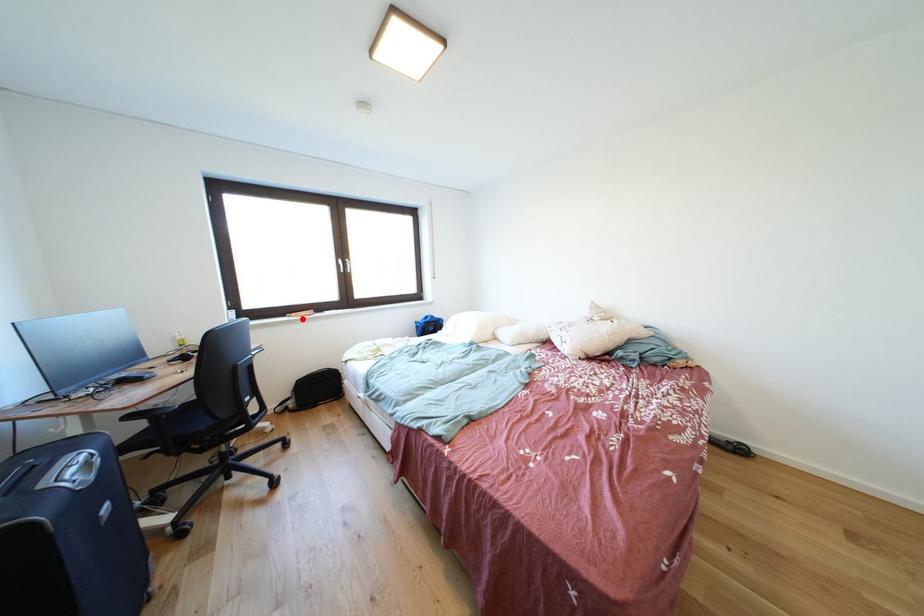
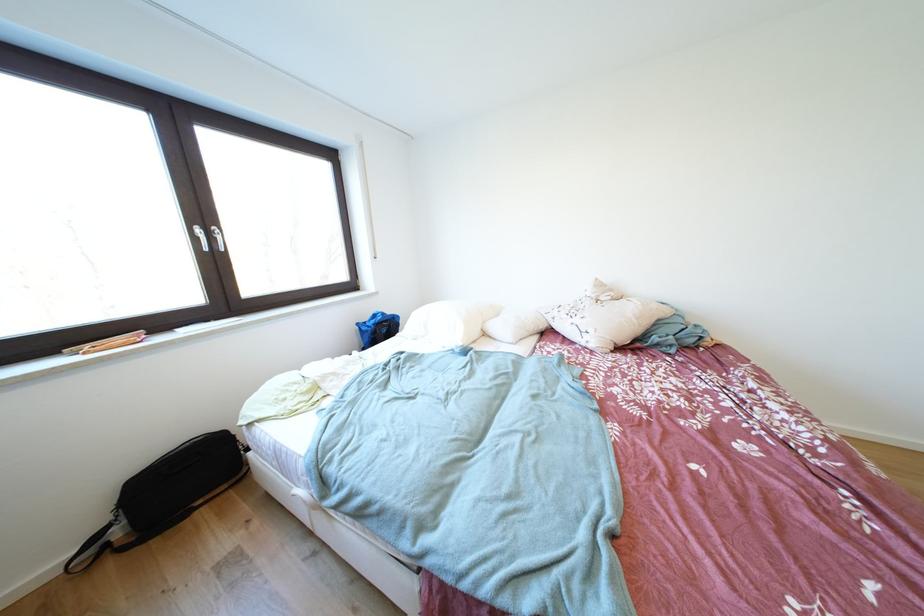
In the second image, find the point that corresponds to the highlighted location in the first image.

(95, 351)